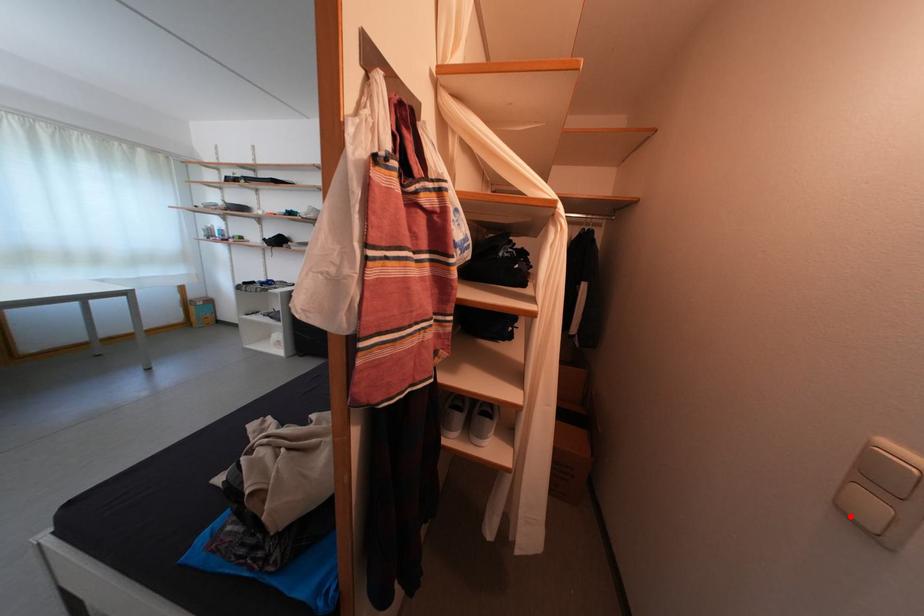
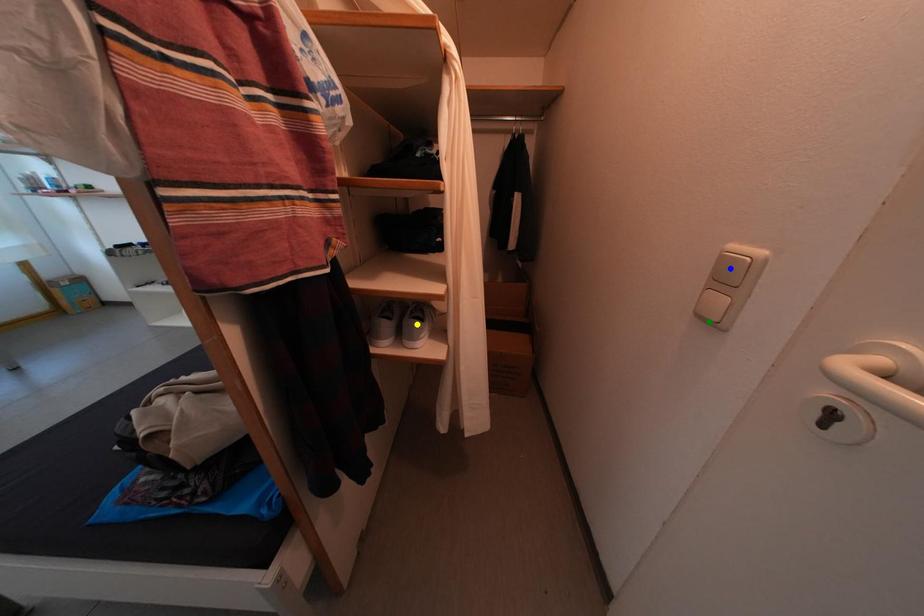
Question: I am providing you with two images of the same scene from different viewpoints. A red point is marked on the first image. You are given multiple points on the second image. Which spot in image 2 lines up with the point in image 1?

Choices:
 (A) blue point
 (B) green point
 (C) yellow point

Answer: (B)